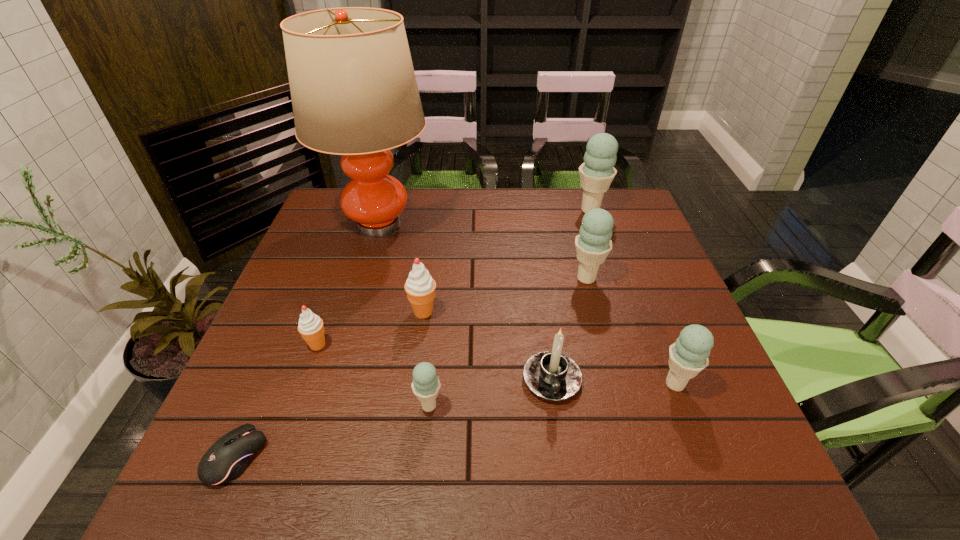
At what (x,y) coordinates should I click in order to perform the action: click on ice cream that is the fifth closest to the second biggest blue ice cream. Please return your answer as a coordinate pair (x, y). Looking at the image, I should click on (311, 328).

Locate which ice cream is the closest to the black computer mouse. Please provide its 2D coordinates. Your answer should be formatted as a tuple, i.e. [(x, y)], where the tuple contains the x and y coordinates of a point satisfying the conditions above.

[(311, 328)]

Locate an element on the screen. blue ice cream that stands as the second closest to the left red icecream is located at coordinates (593, 244).

This screenshot has width=960, height=540. Identify the location of blue ice cream that is the second closest one to the seventh nearest object. (688, 356).